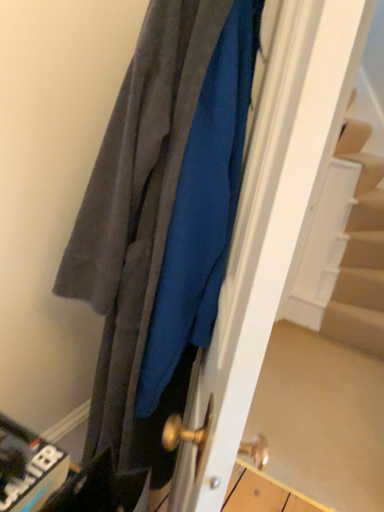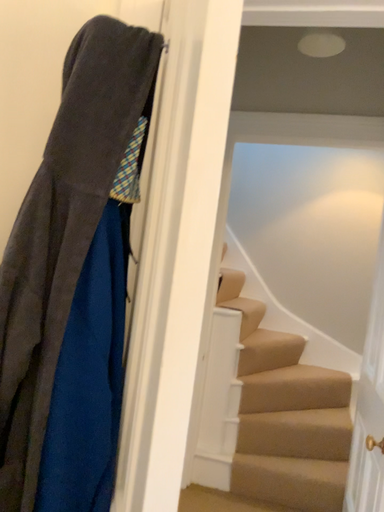
Question: Which way did the camera rotate in the video?

Choices:
 (A) rotated right
 (B) rotated left

Answer: (A)